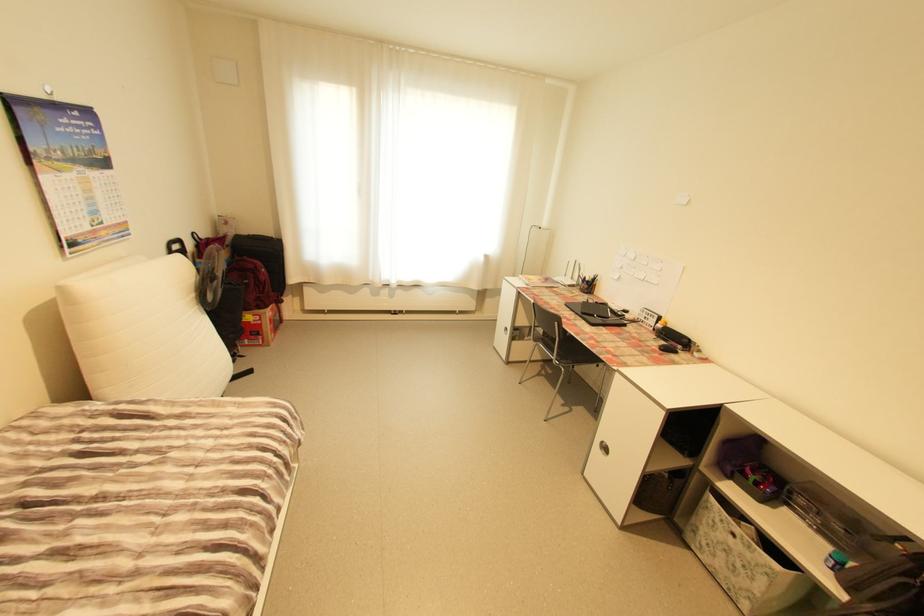
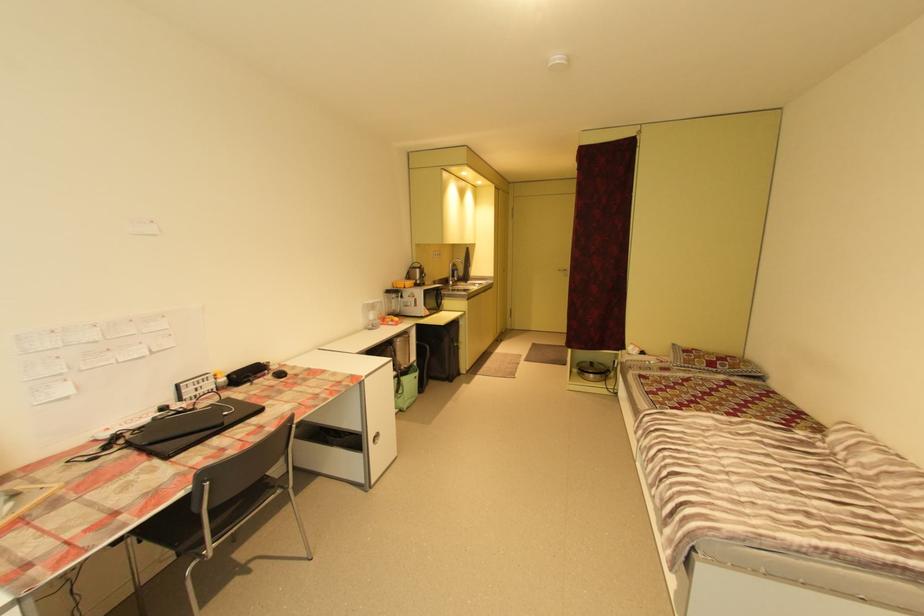
The point at [602,315] is marked in the first image. Where is the corresponding point in the second image?

(232, 414)